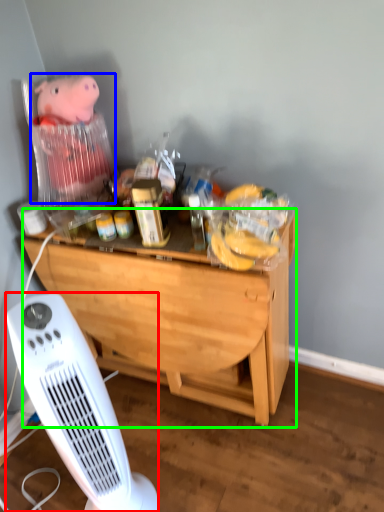
Question: Estimate the real-world distances between objects in this image. Which object is farther from home appliance (highlighted by a red box), toy (highlighted by a blue box) or desk (highlighted by a green box)?

Choices:
 (A) toy
 (B) desk

Answer: (A)